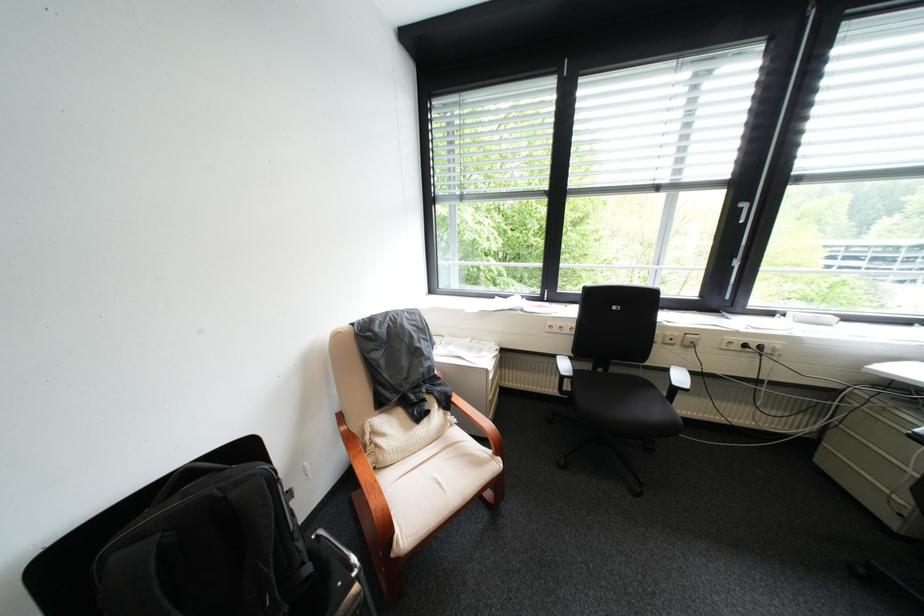
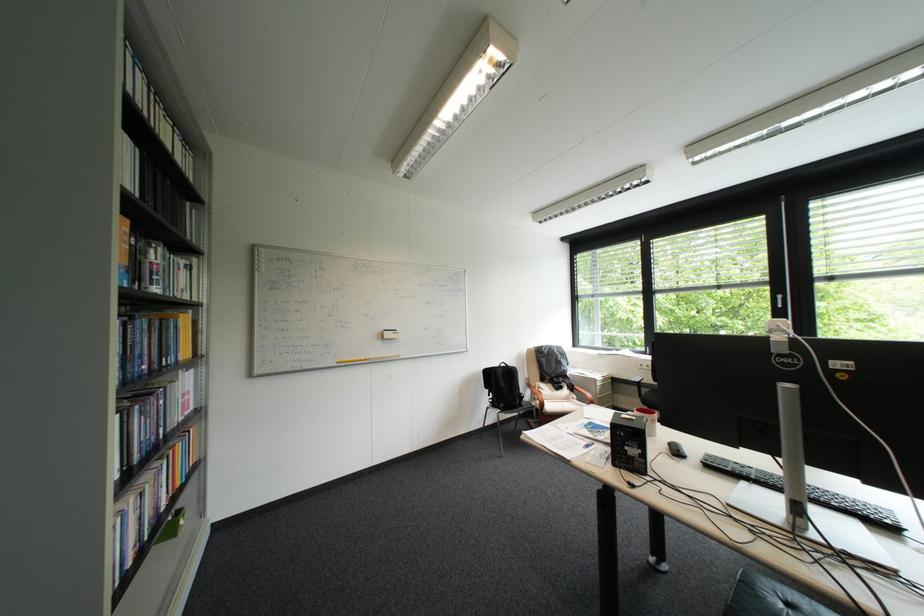
In the second image, find the point that corresponds to point (438, 419) in the first image.

(573, 391)